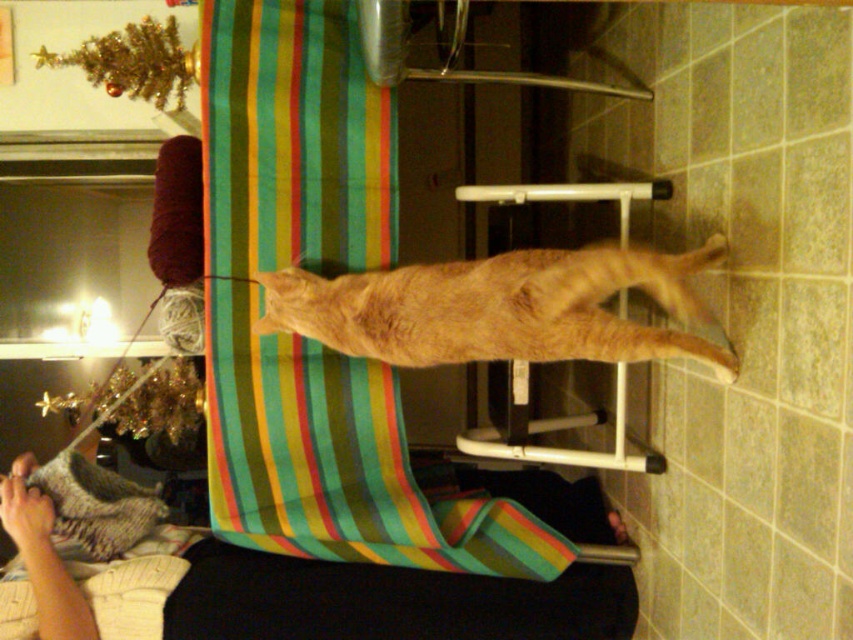
Can you confirm if multicolored striped fabric at center is shorter than orange fur cat at center?

Incorrect, multicolored striped fabric at center's height does not fall short of orange fur cat at center's.

Is point (340, 483) more distant than point (540, 268)?

Yes, it is.

What do you see at coordinates (337, 461) in the screenshot? I see `multicolored striped fabric at center` at bounding box center [337, 461].

I want to click on multicolored striped fabric at center, so click(x=337, y=461).

Is multicolored striped fabric at center smaller than soft beige sweater at lower left?

Correct, multicolored striped fabric at center occupies less space than soft beige sweater at lower left.

Is multicolored striped fabric at center above soft beige sweater at lower left?

Indeed, multicolored striped fabric at center is positioned over soft beige sweater at lower left.

Which is behind, point (294, 392) or point (436, 577)?

The point (436, 577) is more distant.

Identify the location of multicolored striped fabric at center. This screenshot has height=640, width=853. (337, 461).

Where is `soft beige sweater at lower left`? soft beige sweater at lower left is located at coordinates (386, 602).

Is point (569, 525) less distant than point (705, 324)?

No.

Identify the location of soft beige sweater at lower left. The image size is (853, 640). (386, 602).